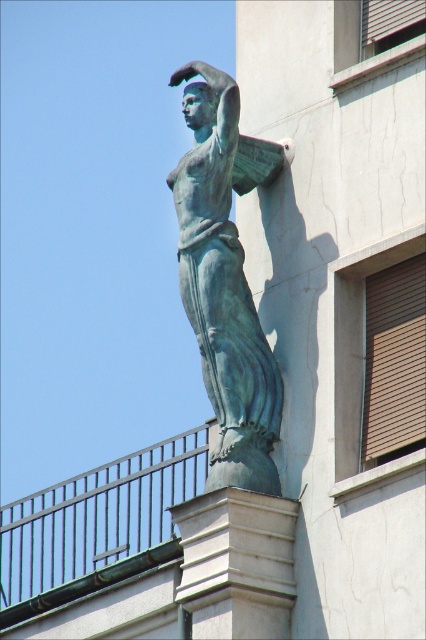
Question: Among these objects, which one is farthest from the camera?

Choices:
 (A) green patina statue at upper center
 (B) white stone column at center

Answer: (A)

Question: Is green patina statue at upper center above white stone column at center?

Choices:
 (A) yes
 (B) no

Answer: (A)

Question: Can you confirm if green patina statue at upper center is bigger than white stone column at center?

Choices:
 (A) no
 (B) yes

Answer: (B)

Question: Which of the following is the closest to the observer?

Choices:
 (A) green patina statue at upper center
 (B) white stone column at center

Answer: (B)

Question: Which point is farther to the camera?

Choices:
 (A) white stone column at center
 (B) green patina statue at upper center

Answer: (B)

Question: Observing the image, what is the correct spatial positioning of green patina statue at upper center in reference to white stone column at center?

Choices:
 (A) right
 (B) left

Answer: (B)